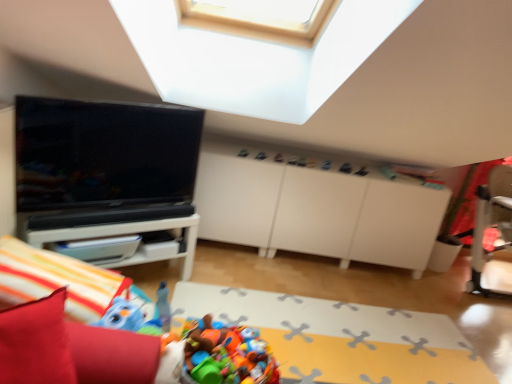
Question: Considering the positions of plastic colorful toys at lower center, which is counted as the third toy, starting from the right, and plastic toy basket at lower center in the image, is plastic colorful toys at lower center, which is counted as the third toy, starting from the right, taller or shorter than plastic toy basket at lower center?

Choices:
 (A) short
 (B) tall

Answer: (B)

Question: From the image's perspective, relative to plastic toy basket at lower center, is plastic colorful toys at lower center, the 3th toy when ordered from back to front, above or below?

Choices:
 (A) below
 (B) above

Answer: (B)

Question: Estimate the real-world distances between objects in this image. Which object is farther from the matte black tv at left?

Choices:
 (A) matte plastic toy at upper center, which ranks as the second toy in left-to-right order
 (B) white matte dresser at center
 (C) plastic toy basket at lower center
 (D) white glossy table at left
 (E) red fabric bean bag chair at lower left

Answer: (E)

Question: Which object is positioned closest to the white glossy table at left?

Choices:
 (A) matte black toy at upper center, the first toy positioned from the back
 (B) matte plastic toy at upper center, which ranks as the second toy in left-to-right order
 (C) red fabric bean bag chair at lower left
 (D) plastic toy basket at lower center
 (E) matte black tv at left

Answer: (E)